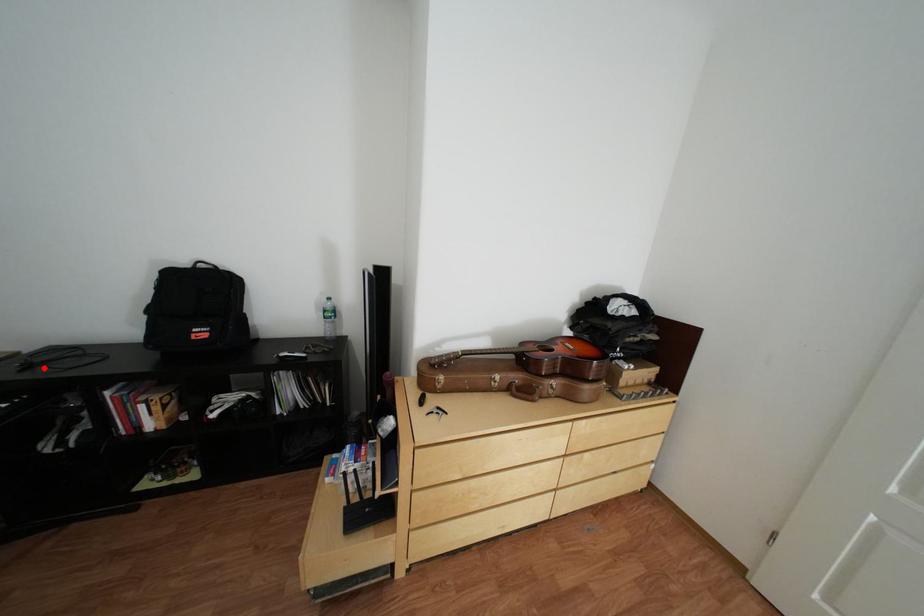
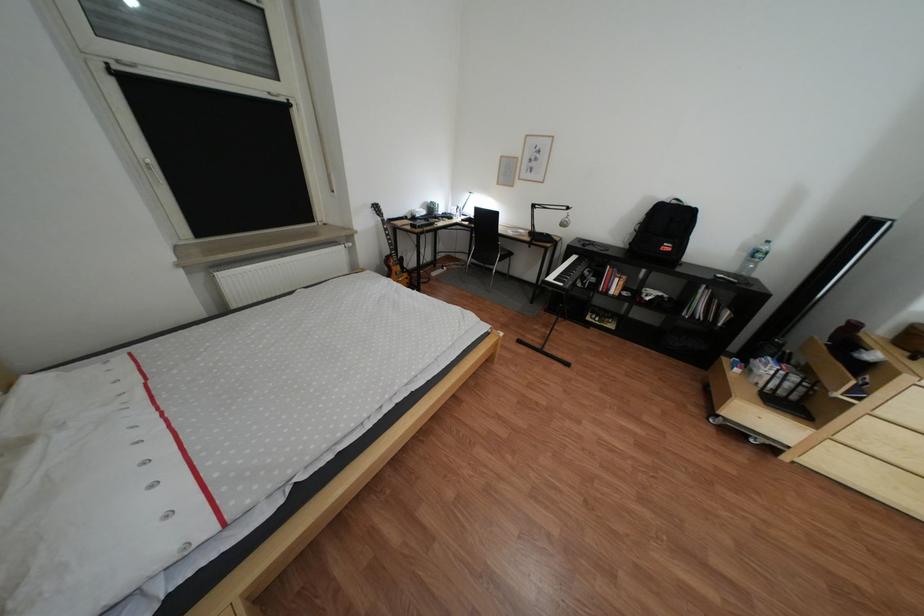
Locate, in the second image, the point that corresponds to the highlighted location in the first image.

(600, 246)